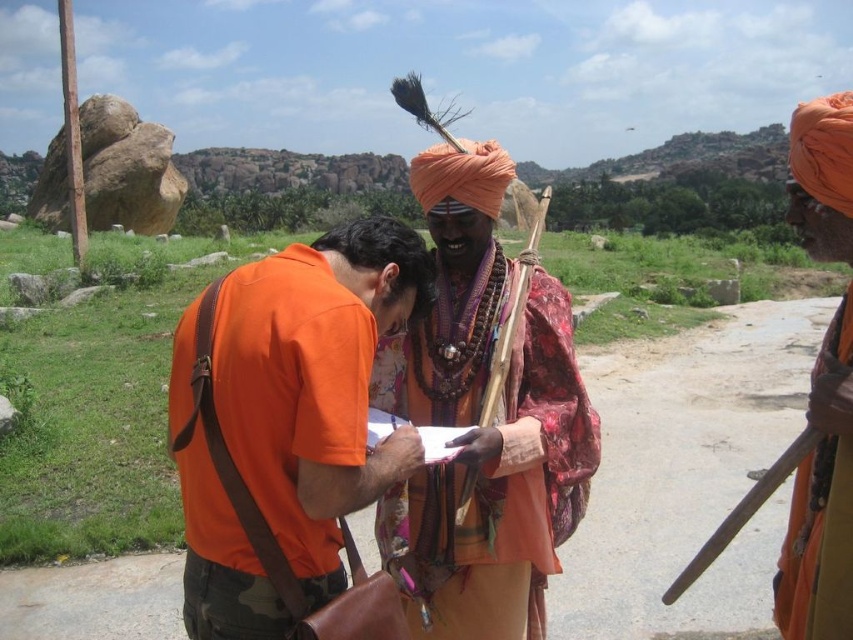
Measure the distance from orange cotton shirt at center to orange turban at right.

orange cotton shirt at center and orange turban at right are 12.61 meters apart from each other.

The image size is (853, 640). Describe the element at coordinates (285, 422) in the screenshot. I see `orange cotton shirt at center` at that location.

Between point (242, 429) and point (776, 593), which one is positioned in front?

Point (242, 429) is in front.

Find the location of a particular element. The height and width of the screenshot is (640, 853). orange cotton shirt at center is located at coordinates (285, 422).

Which of these two, textured silk robe at center or orange turban at right, stands shorter?

With less height is textured silk robe at center.

Can you confirm if textured silk robe at center is positioned to the left of orange turban at right?

Correct, you'll find textured silk robe at center to the left of orange turban at right.

Describe the element at coordinates (502, 493) in the screenshot. I see `textured silk robe at center` at that location.

At what (x,y) coordinates should I click in order to perform the action: click on textured silk robe at center. Please return your answer as a coordinate pair (x, y). The height and width of the screenshot is (640, 853). Looking at the image, I should click on (502, 493).

Which is more to the right, orange cotton shirt at center or textured silk robe at center?

textured silk robe at center is more to the right.

Between point (202, 378) and point (549, 358), which one is positioned behind?

Point (549, 358)

Is point (267, 497) behind point (461, 560)?

No.

Find the location of a particular element. The width and height of the screenshot is (853, 640). orange cotton shirt at center is located at coordinates (285, 422).